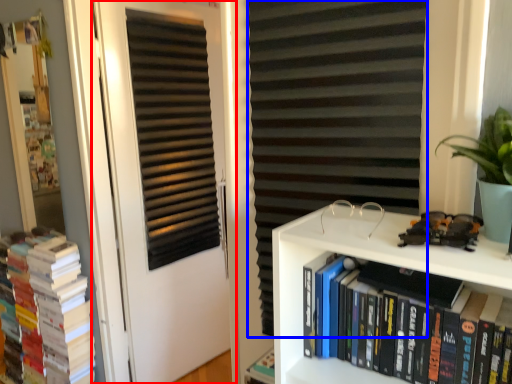
Question: Which object appears closest to the camera in this image, door (highlighted by a red box) or curtain (highlighted by a blue box)?

Choices:
 (A) door
 (B) curtain

Answer: (B)